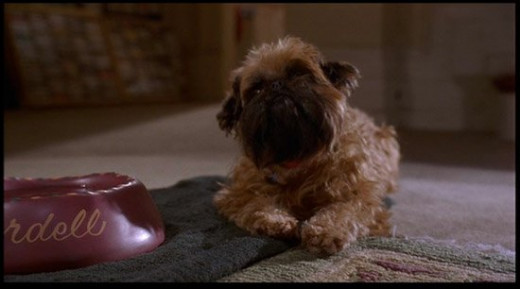
The height and width of the screenshot is (289, 520). Find the location of `water bowl`. water bowl is located at coordinates (118, 210).